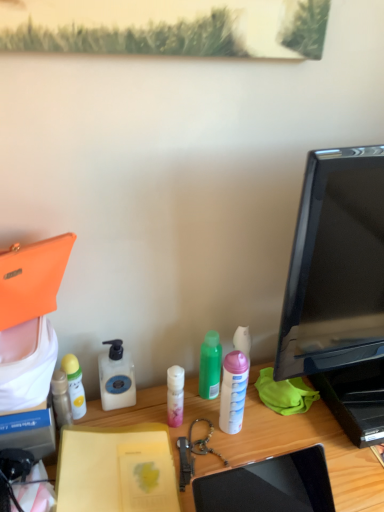
Where is `vacant area that is in front of green matte bottle at center, placed as the fourth bottle when sorted from left to right`? This screenshot has height=512, width=384. vacant area that is in front of green matte bottle at center, placed as the fourth bottle when sorted from left to right is located at coordinates (203, 445).